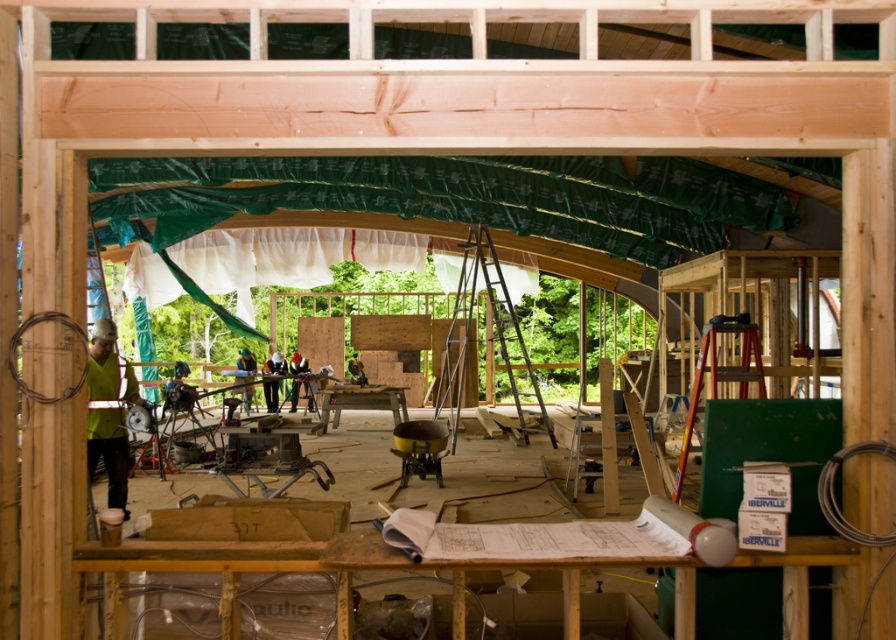
You are a construction worker standing at the doorway of the construction site. You need to retrieve the camera that is 15.67 meters away from the green fabric at center. Which direction should you move to reach the camera?

The camera is 15.67 meters away from the green fabric at center. Since the green fabric at center is located in the midground of the construction site, you should move towards the midground area where the green fabric at center is situated to find the camera.

You are standing at the entrance of the construction site. You need to locate the yellow fabric at left. According to the coordinates provided, where exactly is it positioned?

The yellow fabric at left is located at point (108, 412).